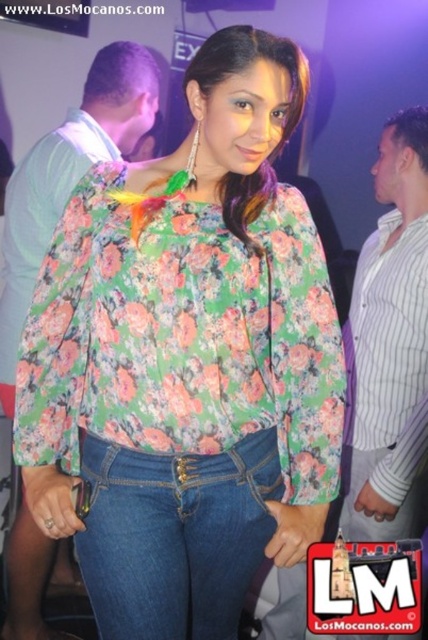
Question: Estimate the real-world distances between objects in this image. Which object is farther from the denim jeans at center?

Choices:
 (A) floral fabric shirt at upper left
 (B) striped cotton shirt at right

Answer: (A)

Question: Is denim jeans at center wider than striped cotton shirt at right?

Choices:
 (A) yes
 (B) no

Answer: (A)

Question: Which of these objects is positioned closest to the striped cotton shirt at right?

Choices:
 (A) floral fabric shirt at upper left
 (B) denim jeans at center

Answer: (B)

Question: Among these objects, which one is nearest to the camera?

Choices:
 (A) denim jeans at center
 (B) striped cotton shirt at right

Answer: (A)

Question: Is denim jeans at center further to camera compared to floral fabric shirt at upper left?

Choices:
 (A) yes
 (B) no

Answer: (B)

Question: Does denim jeans at center appear on the left side of floral fabric shirt at upper left?

Choices:
 (A) no
 (B) yes

Answer: (A)